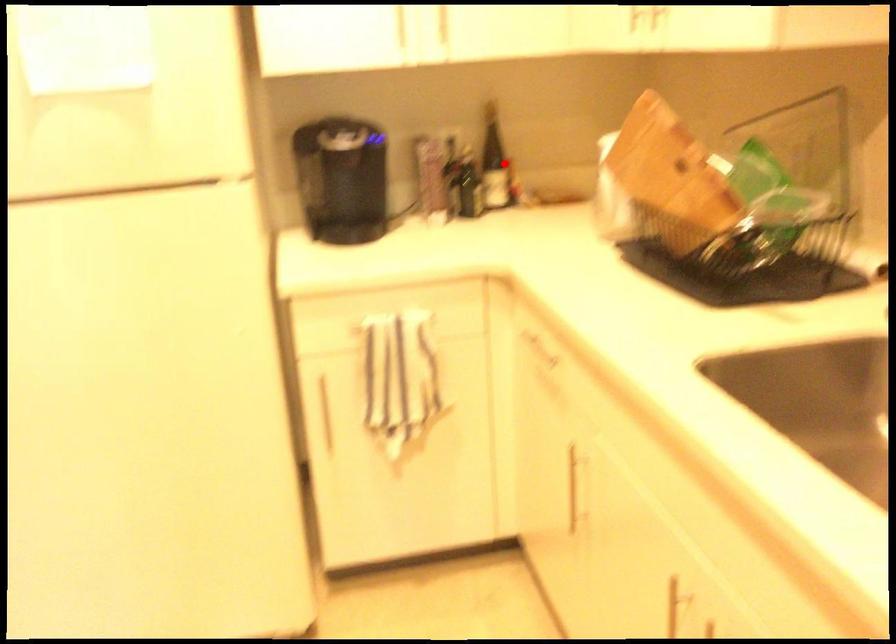
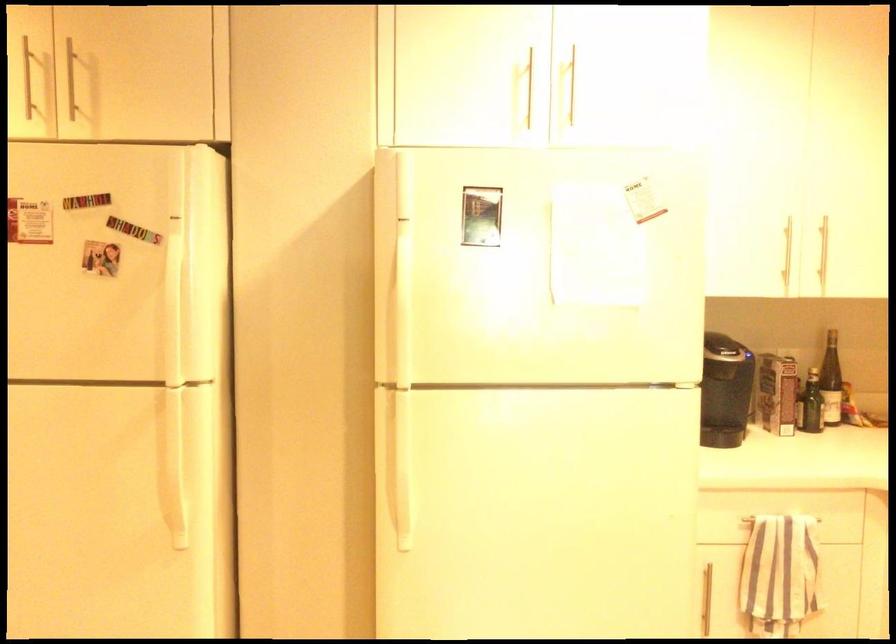
Locate, in the second image, the point that corresponds to the highlighted location in the first image.

(831, 381)